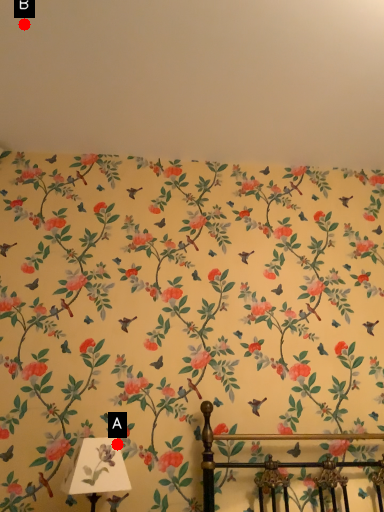
Question: Two points are circled on the image, labeled by A and B beside each circle. Among these points, which one is nearest to the camera?

Choices:
 (A) A is closer
 (B) B is closer

Answer: (A)